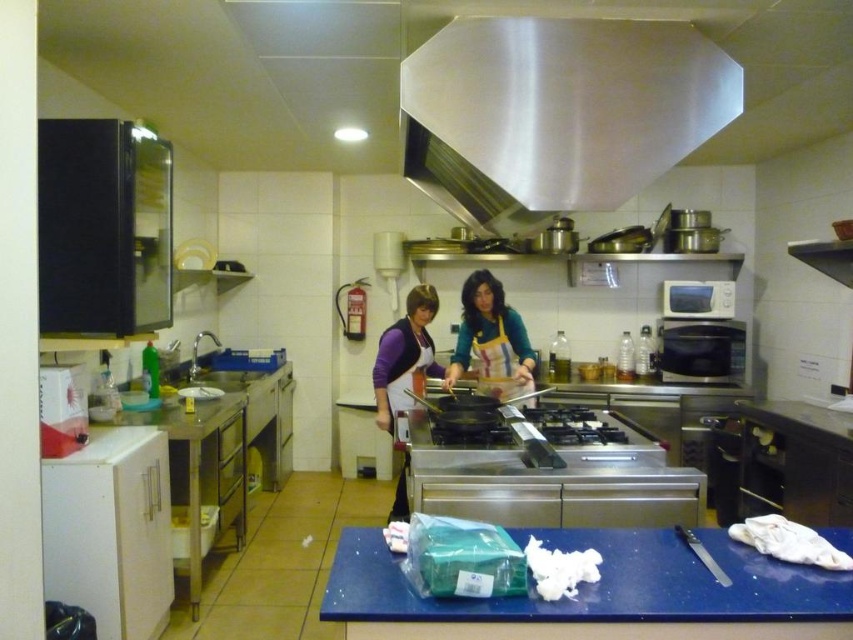
Question: Does blue plastic cutting board at lower center have a lesser width compared to yellow apron at center?

Choices:
 (A) no
 (B) yes

Answer: (A)

Question: Considering the relative positions of satin silver exhaust hood at upper center and purple fabric apron at center in the image provided, where is satin silver exhaust hood at upper center located with respect to purple fabric apron at center?

Choices:
 (A) above
 (B) below

Answer: (A)

Question: Based on their relative distances, which object is nearer to the satin silver exhaust hood at upper center?

Choices:
 (A) blue plastic cutting board at lower center
 (B) purple fabric apron at center

Answer: (A)

Question: Does satin silver exhaust hood at upper center come behind purple fabric apron at center?

Choices:
 (A) no
 (B) yes

Answer: (A)

Question: Which object appears closest to the camera in this image?

Choices:
 (A) purple fabric apron at center
 (B) yellow apron at center

Answer: (B)

Question: Which object is farther from the camera taking this photo?

Choices:
 (A) purple fabric apron at center
 (B) satin silver exhaust hood at upper center

Answer: (A)